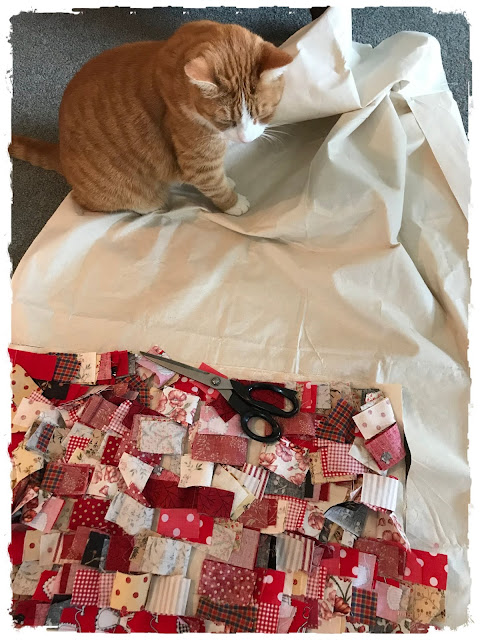
Image resolution: width=480 pixels, height=640 pixels. I want to click on white sheet, so click(x=387, y=368).